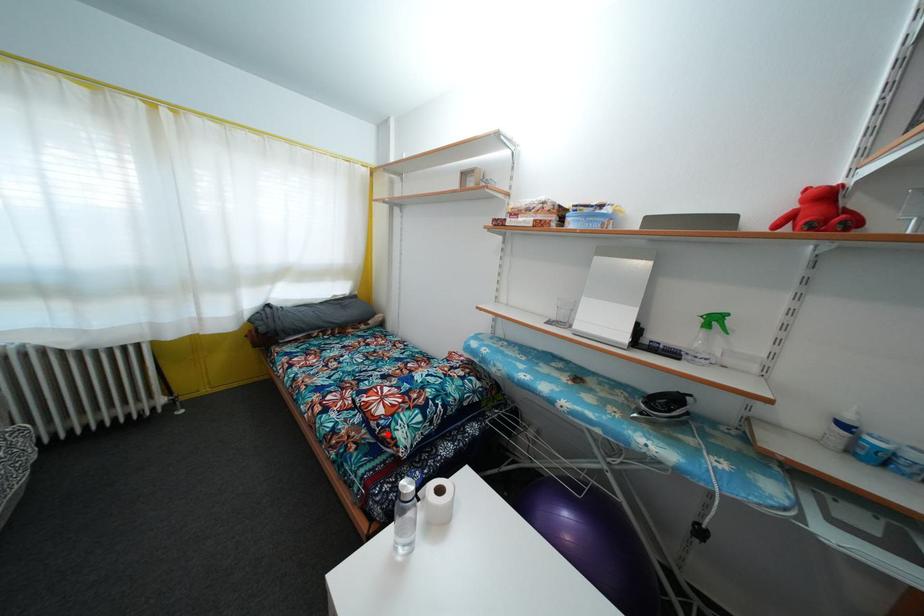
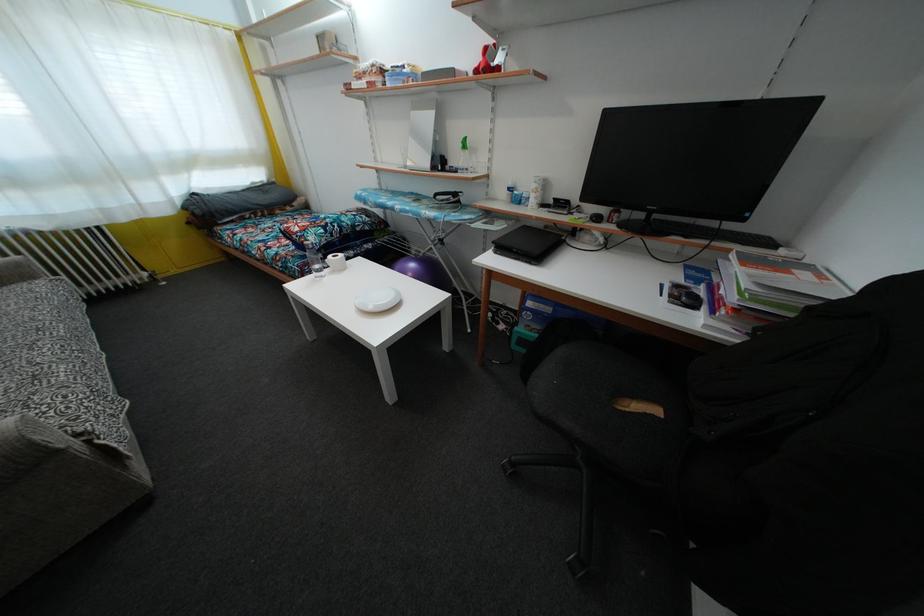
Question: I am providing you with two images of the same scene from different viewpoints. Image1 has a red point marked. In image2, the corresponding 3D location appears at what relative position? Reply with the corresponding letter.

Choices:
 (A) Closer
 (B) Farther

Answer: (A)